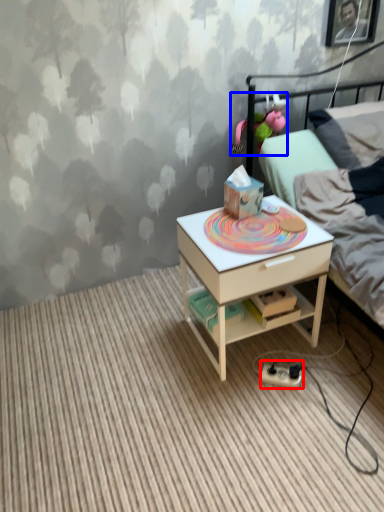
Question: Among these objects, which one is farthest to the camera, equipment (highlighted by a red box) or toy (highlighted by a blue box)?

Choices:
 (A) equipment
 (B) toy

Answer: (B)